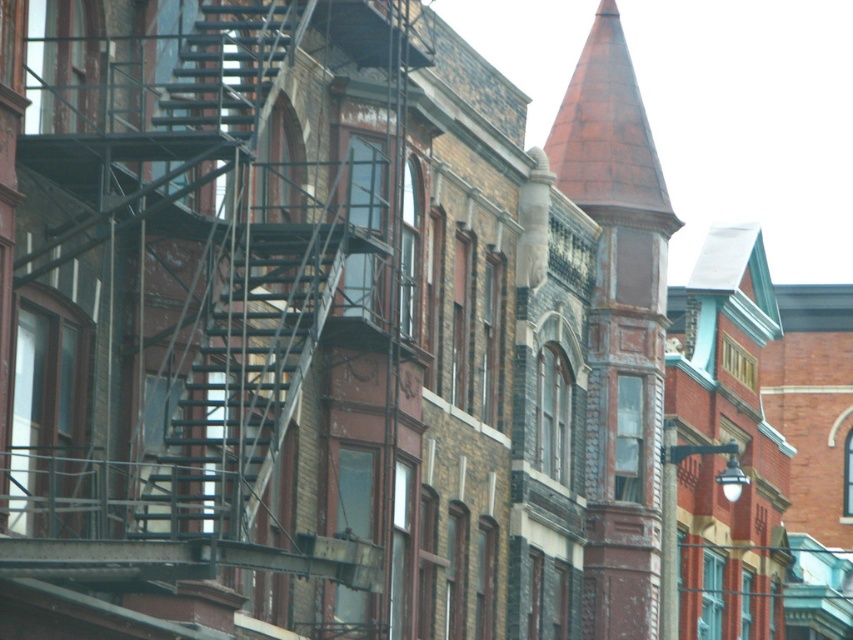
What object is located at the coordinates point (200, 308) in the image?

The point (200, 308) marks the location of the metallic fire escape at left.

You are standing in front of the row of buildings and want to locate the two metallic fire escapes. Which one is positioned more to the left between the metallic fire escape at left and the metallic fire escape at center?

The metallic fire escape at center is positioned more to the left than the metallic fire escape at left because the metallic fire escape at left is to the right of metallic fire escape at center.

You are standing in front of the buildings and notice both the rusty metal spire at center and the metallic fire escape at center. Which object is located higher up in the image?

The rusty metal spire at center is positioned over the metallic fire escape at center, so it is located higher up in the image.